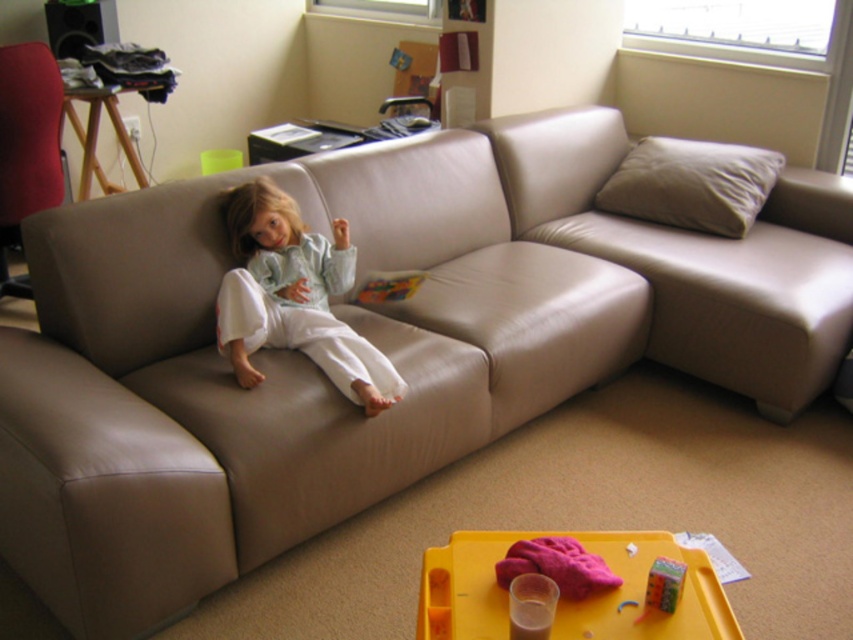
Question: Can you confirm if white cotton pants at center is wider than suede-like beige pillow at upper right?

Choices:
 (A) no
 (B) yes

Answer: (A)

Question: Which point appears closest to the camera in this image?

Choices:
 (A) (265, 310)
 (B) (607, 612)

Answer: (B)

Question: Does leather couch at center have a smaller size compared to white cotton pants at center?

Choices:
 (A) no
 (B) yes

Answer: (A)

Question: Does leather couch at center appear over suede-like beige pillow at upper right?

Choices:
 (A) yes
 (B) no

Answer: (B)

Question: Estimate the real-world distances between objects in this image. Which object is closer to the suede-like beige pillow at upper right?

Choices:
 (A) white cotton pants at center
 (B) yellow plastic tray at lower center

Answer: (A)

Question: Estimate the real-world distances between objects in this image. Which object is closer to the leather couch at center?

Choices:
 (A) white cotton pants at center
 (B) yellow plastic tray at lower center

Answer: (A)